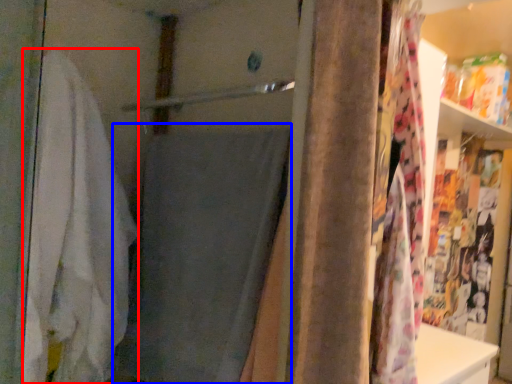
Question: Which object is further to the camera taking this photo, bath towel (highlighted by a red box) or bath towel (highlighted by a blue box)?

Choices:
 (A) bath towel
 (B) bath towel

Answer: (A)